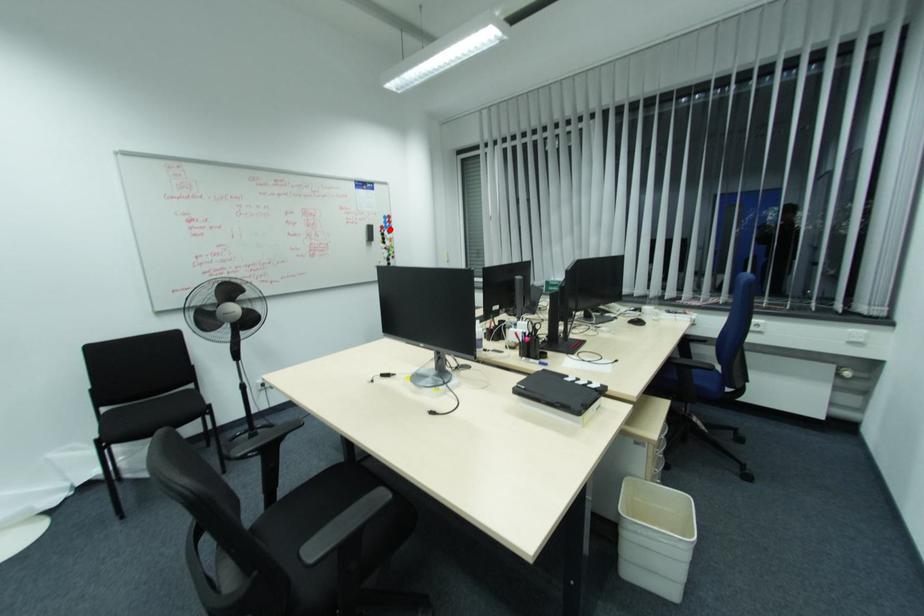
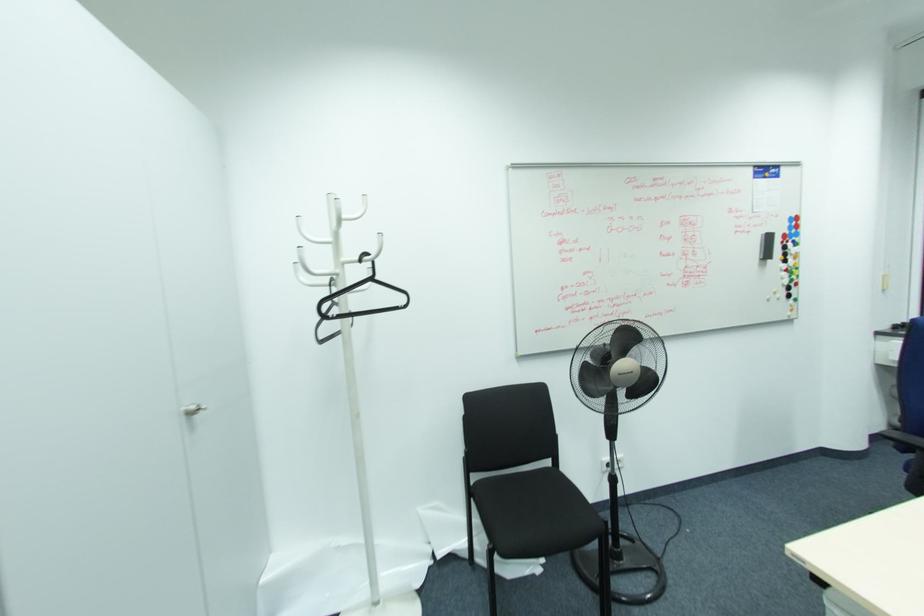
Question: A red point is marked in image1. In image2, is the corresponding 3D point closer to the camera or farther? Reply with the corresponding letter.

Choices:
 (A) The corresponding 3D point is closer.
 (B) The corresponding 3D point is farther.

Answer: (B)